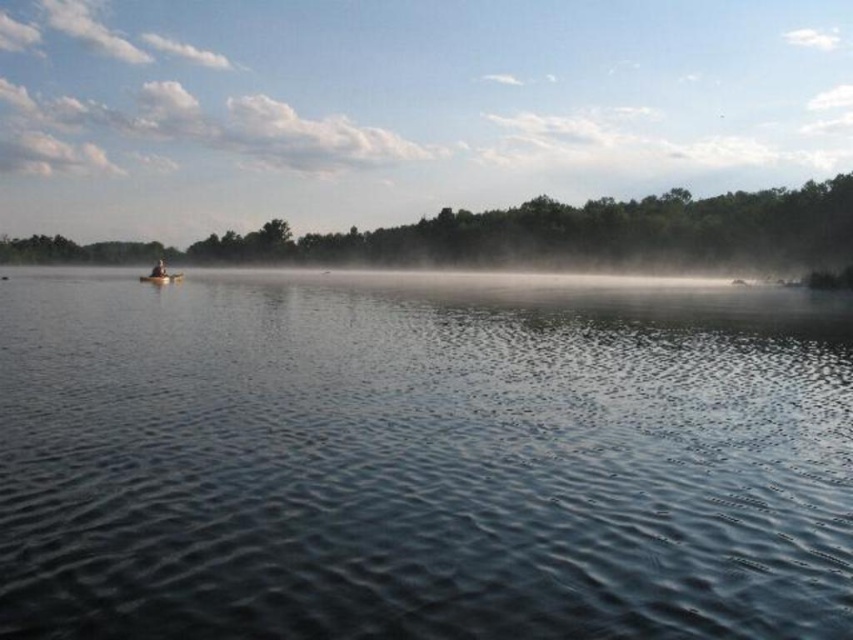
You are an observer standing on the lakeside and see the smooth wooden canoe at left and the brown wooden boat at left. Which one has a higher height from the water surface?

The smooth wooden canoe at left is much taller as brown wooden boat at left, so the smooth wooden canoe at left has a higher height from the water surface.

You are standing on the lakeside and see the brown wooden boat at left and the black plastic paddle at left. Which object is positioned more to the left side?

The brown wooden boat at left is positioned more to the left side than the black plastic paddle at left.

You are standing at the center of the lake and see a point marked at coordinates (402, 106). What object is located at that point?

The point at coordinates (402, 106) indicates a smooth wooden canoe at left.